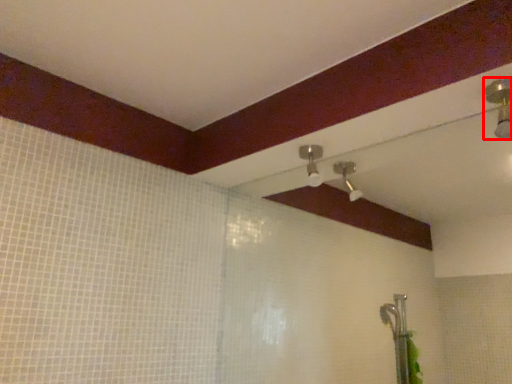
Question: In this image, where is shower (annotated by the red box) located relative to shower?

Choices:
 (A) right
 (B) left

Answer: (A)